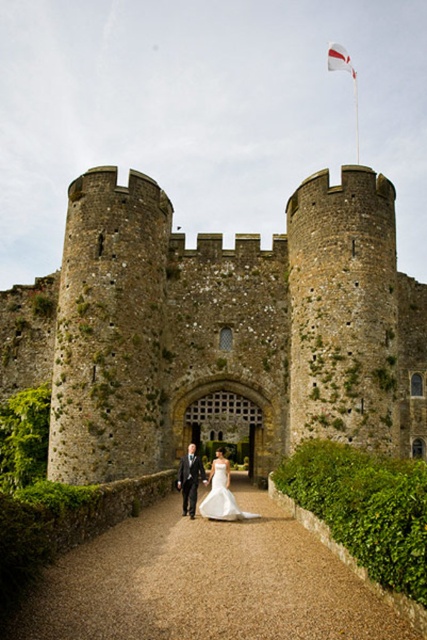
Question: Which object appears closest to the camera in this image?

Choices:
 (A) white satin dress at center
 (B) white fabric flag at upper center

Answer: (A)

Question: Can you confirm if stone textured castle at center is bigger than brown gravel path at center?

Choices:
 (A) no
 (B) yes

Answer: (B)

Question: Is white satin dress at center behind white fabric flag at upper center?

Choices:
 (A) yes
 (B) no

Answer: (B)

Question: Which point is farther from the camera taking this photo?

Choices:
 (A) (243, 609)
 (B) (204, 481)

Answer: (B)

Question: Which point appears closest to the camera in this image?

Choices:
 (A) (225, 624)
 (B) (192, 465)
 (C) (341, 51)
 (D) (408, 445)

Answer: (A)

Question: Can you confirm if stone textured castle at center is thinner than brown gravel path at center?

Choices:
 (A) yes
 (B) no

Answer: (B)